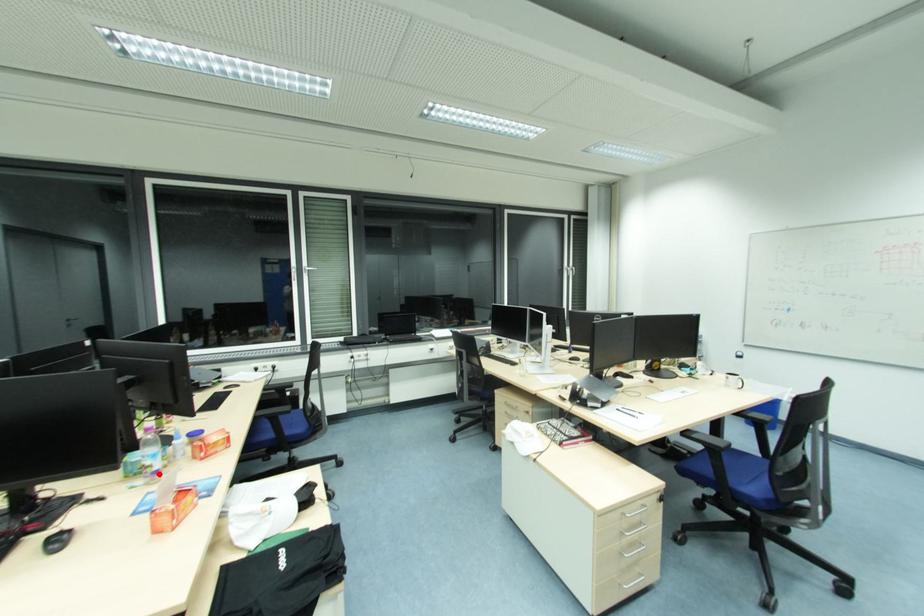
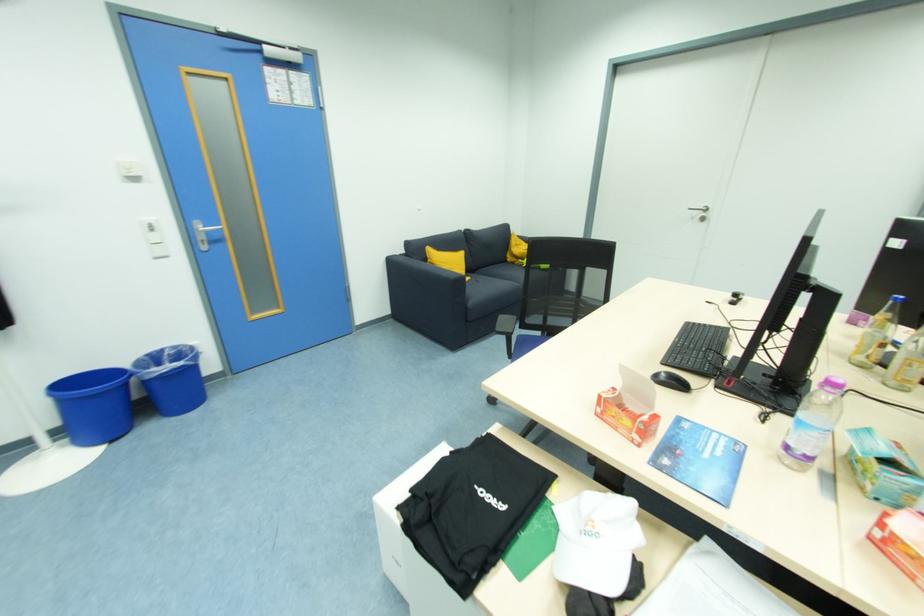
Where in the second image is the point corresponding to the highlighted location from the first image?

(792, 448)